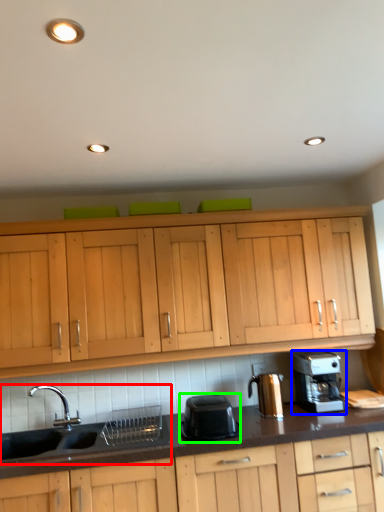
Question: Considering the real-world distances, which object is closest to sink (highlighted by a red box)? home appliance (highlighted by a blue box) or kitchen appliance (highlighted by a green box).

Choices:
 (A) home appliance
 (B) kitchen appliance

Answer: (B)